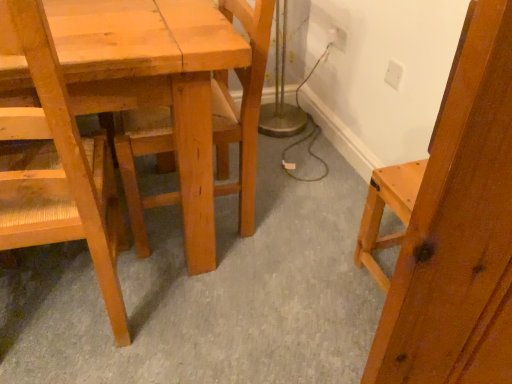
Image resolution: width=512 pixels, height=384 pixels. What are the coordinates of `natural wood chair at left, acting as the first chair starting from the left` in the screenshot? It's located at (56, 165).

The image size is (512, 384). What do you see at coordinates (56, 165) in the screenshot?
I see `natural wood chair at left, the second chair positioned from the right` at bounding box center [56, 165].

This screenshot has height=384, width=512. Identify the location of natural wood chair at center, which is the second chair from left to right. (242, 108).

The height and width of the screenshot is (384, 512). What do you see at coordinates (337, 38) in the screenshot?
I see `white plastic electric outlet at upper right, which appears as the 2th electric outlet when ordered from the bottom` at bounding box center [337, 38].

Image resolution: width=512 pixels, height=384 pixels. I want to click on natural wood chair at left, the second chair positioned from the right, so click(x=56, y=165).

Which is in front, point (18, 206) or point (241, 214)?

The point (18, 206) is closer.

Can you confirm if natural wood chair at left, acting as the first chair starting from the left, is smaller than natural wood chair at center, which is the second chair from left to right?

No, natural wood chair at left, acting as the first chair starting from the left, is not smaller than natural wood chair at center, which is the second chair from left to right.

From the image's perspective, is natural wood chair at left, the second chair positioned from the right, located beneath natural wood chair at center, which is the second chair from left to right?

Yes.

Is natural wood chair at left, acting as the first chair starting from the left, positioned in front of white plastic electric outlet at upper right, arranged as the 2th electric outlet when viewed from the front?

Yes, natural wood chair at left, acting as the first chair starting from the left, is in front of white plastic electric outlet at upper right, arranged as the 2th electric outlet when viewed from the front.

Does natural wood chair at left, acting as the first chair starting from the left, have a greater width compared to white plastic electric outlet at upper right, arranged as the 2th electric outlet when viewed from the front?

Yes.

In terms of size, does natural wood chair at left, the second chair positioned from the right, appear bigger or smaller than white plastic electric outlet at upper right, which appears as the 2th electric outlet when ordered from the bottom?

natural wood chair at left, the second chair positioned from the right, is bigger than white plastic electric outlet at upper right, which appears as the 2th electric outlet when ordered from the bottom.

Could you tell me if natural wood chair at left, acting as the first chair starting from the left, is facing white plastic electric outlet at upper right, which is the second electric outlet in right-to-left order?

No, natural wood chair at left, acting as the first chair starting from the left, is not facing towards white plastic electric outlet at upper right, which is the second electric outlet in right-to-left order.

From the image's perspective, is white plastic electric outlet at upper right, the first electric outlet in the bottom-to-top sequence, above natural wood chair at left, acting as the first chair starting from the left?

Yes.

From a real-world perspective, does white plastic electric outlet at upper right, the first electric outlet in the bottom-to-top sequence, sit lower than natural wood chair at left, the second chair positioned from the right?

No, from a real-world perspective, white plastic electric outlet at upper right, the first electric outlet in the bottom-to-top sequence, is not below natural wood chair at left, the second chair positioned from the right.

Considering the sizes of objects white plastic electric outlet at upper right, arranged as the 2th electric outlet when viewed from the back, and natural wood chair at left, acting as the first chair starting from the left, in the image provided, who is shorter, white plastic electric outlet at upper right, arranged as the 2th electric outlet when viewed from the back, or natural wood chair at left, acting as the first chair starting from the left,?

With less height is white plastic electric outlet at upper right, arranged as the 2th electric outlet when viewed from the back.

Who is taller, natural wood chair at center, the 1th chair positioned from the right, or white plastic electric outlet at upper right, the 1th electric outlet positioned from the back?

natural wood chair at center, the 1th chair positioned from the right, is taller.

Which point is more distant from viewer, (242,188) or (331,37)?

The point (331,37) is farther from the camera.

Who is bigger, natural wood chair at center, the 1th chair positioned from the right, or white plastic electric outlet at upper right, the 1th electric outlet from the left?

natural wood chair at center, the 1th chair positioned from the right.

What's the angular difference between natural wood chair at center, which is the second chair from left to right, and natural wood chair at left, the second chair positioned from the right,'s facing directions?

93.3 degrees separate the facing orientations of natural wood chair at center, which is the second chair from left to right, and natural wood chair at left, the second chair positioned from the right.

From the image's perspective, which object appears higher, natural wood chair at center, which is the second chair from left to right, or natural wood chair at left, the second chair positioned from the right?

natural wood chair at center, which is the second chair from left to right, appears higher in the image.

Who is smaller, natural wood chair at center, which is the second chair from left to right, or natural wood chair at left, the second chair positioned from the right?

With smaller size is natural wood chair at center, which is the second chair from left to right.

Are natural wood chair at center, the 1th chair positioned from the right, and natural wood chair at left, acting as the first chair starting from the left, located far from each other?

Actually, natural wood chair at center, the 1th chair positioned from the right, and natural wood chair at left, acting as the first chair starting from the left, are a little close together.

Is white plastic electric outlet at upper right, the second electric outlet viewed from the top, completely or partially inside natural wood chair at left, the second chair positioned from the right?

Definitely not — white plastic electric outlet at upper right, the second electric outlet viewed from the top, is not inside natural wood chair at left, the second chair positioned from the right.

Which is behind, point (6, 160) or point (394, 77)?

Point (394, 77)

Locate an element on the screen. the 2nd electric outlet directly above the natural wood chair at left, acting as the first chair starting from the left (from a real-world perspective) is located at coordinates (393, 74).

Is natural wood chair at left, acting as the first chair starting from the left, wider than white plastic electric outlet at upper right, arranged as the 2th electric outlet when viewed from the left?

Correct, the width of natural wood chair at left, acting as the first chair starting from the left, exceeds that of white plastic electric outlet at upper right, arranged as the 2th electric outlet when viewed from the left.

Would you say white plastic electric outlet at upper right, which is the second electric outlet in right-to-left order, is to the left or to the right of natural wood chair at center, the 1th chair positioned from the right, in the picture?

Based on their positions, white plastic electric outlet at upper right, which is the second electric outlet in right-to-left order, is located to the right of natural wood chair at center, the 1th chair positioned from the right.

Which of these two, white plastic electric outlet at upper right, the 1th electric outlet from the left, or natural wood chair at center, which is the second chair from left to right, is thinner?

Thinner between the two is white plastic electric outlet at upper right, the 1th electric outlet from the left.

Which is correct: white plastic electric outlet at upper right, the 1th electric outlet from the left, is inside natural wood chair at center, the 1th chair positioned from the right, or outside of it?

white plastic electric outlet at upper right, the 1th electric outlet from the left, is outside natural wood chair at center, the 1th chair positioned from the right.

Is white plastic electric outlet at upper right, which appears as the 2th electric outlet when ordered from the bottom, facing away from natural wood chair at center, the 1th chair positioned from the right?

That's not correct — white plastic electric outlet at upper right, which appears as the 2th electric outlet when ordered from the bottom, is not looking away from natural wood chair at center, the 1th chair positioned from the right.

At what (x,y) coordinates should I click in order to perform the action: click on chair lying on the left of natural wood chair at center, which is the second chair from left to right. Please return your answer as a coordinate pair (x, y). This screenshot has height=384, width=512. Looking at the image, I should click on (56, 165).

From a real-world perspective, count 1st electric outlets upward from the natural wood chair at left, acting as the first chair starting from the left, and point to it. Please provide its 2D coordinates.

[(337, 38)]

Looking at the image, which one is located closer to natural wood chair at left, acting as the first chair starting from the left, white plastic electric outlet at upper right, the second electric outlet viewed from the top, or white plastic electric outlet at upper right, the 1th electric outlet from the left?

The object closer to natural wood chair at left, acting as the first chair starting from the left, is white plastic electric outlet at upper right, the second electric outlet viewed from the top.

Estimate the real-world distances between objects in this image. Which object is further from white plastic electric outlet at upper right, the 1th electric outlet from the front, natural wood chair at center, the 1th chair positioned from the right, or natural wood chair at left, the second chair positioned from the right?

Based on the image, natural wood chair at left, the second chair positioned from the right, appears to be further to white plastic electric outlet at upper right, the 1th electric outlet from the front.

Based on the photo, when comparing their distances from white plastic electric outlet at upper right, the 1th electric outlet from the front, does natural wood chair at left, the second chair positioned from the right, or white plastic electric outlet at upper right, which appears as the 2th electric outlet when ordered from the bottom, seem further?

Based on the image, natural wood chair at left, the second chair positioned from the right, appears to be further to white plastic electric outlet at upper right, the 1th electric outlet from the front.

From the image, which object appears to be nearer to natural wood chair at left, acting as the first chair starting from the left, white plastic electric outlet at upper right, the 1th electric outlet positioned from the back, or natural wood chair at center, which is the second chair from left to right?

natural wood chair at center, which is the second chair from left to right.

Estimate the real-world distances between objects in this image. Which object is further from natural wood chair at left, acting as the first chair starting from the left, natural wood chair at center, which is the second chair from left to right, or white plastic electric outlet at upper right, the 1th electric outlet from the front?

white plastic electric outlet at upper right, the 1th electric outlet from the front.

Based on their spatial positions, is white plastic electric outlet at upper right, the 1th electric outlet from the front, or natural wood chair at center, the 1th chair positioned from the right, further from natural wood chair at left, acting as the first chair starting from the left?

white plastic electric outlet at upper right, the 1th electric outlet from the front.

From the image, which object appears to be farther from white plastic electric outlet at upper right, the 1th electric outlet from the left, white plastic electric outlet at upper right, the second electric outlet viewed from the top, or natural wood chair at left, acting as the first chair starting from the left?

Based on the image, natural wood chair at left, acting as the first chair starting from the left, appears to be further to white plastic electric outlet at upper right, the 1th electric outlet from the left.

Which object lies further to the anchor point white plastic electric outlet at upper right, arranged as the 2th electric outlet when viewed from the left, natural wood chair at left, the second chair positioned from the right, or natural wood chair at center, the 1th chair positioned from the right?

Based on the image, natural wood chair at left, the second chair positioned from the right, appears to be further to white plastic electric outlet at upper right, arranged as the 2th electric outlet when viewed from the left.

At what (x,y) coordinates should I click in order to perform the action: click on electric outlet positioned between natural wood chair at center, the 1th chair positioned from the right, and white plastic electric outlet at upper right, arranged as the 2th electric outlet when viewed from the front, from near to far. Please return your answer as a coordinate pair (x, y). The width and height of the screenshot is (512, 384). Looking at the image, I should click on (393, 74).

You are a GUI agent. You are given a task and a screenshot of the screen. Output one action in this format:
    pyautogui.click(x=<x>, y=<y>)
    Task: Click on the chair between natural wood chair at left, the second chair positioned from the right, and white plastic electric outlet at upper right, which is the second electric outlet in right-to-left order, along the z-axis
    Image resolution: width=512 pixels, height=384 pixels.
    Given the screenshot: What is the action you would take?
    pyautogui.click(x=242, y=108)

This screenshot has width=512, height=384. I want to click on electric outlet located between natural wood chair at left, the second chair positioned from the right, and white plastic electric outlet at upper right, the 1th electric outlet from the left, in the depth direction, so click(x=393, y=74).

At what (x,y) coordinates should I click in order to perform the action: click on chair situated between natural wood chair at left, acting as the first chair starting from the left, and white plastic electric outlet at upper right, the second electric outlet viewed from the top, from left to right. Please return your answer as a coordinate pair (x, y). Image resolution: width=512 pixels, height=384 pixels. Looking at the image, I should click on (242, 108).